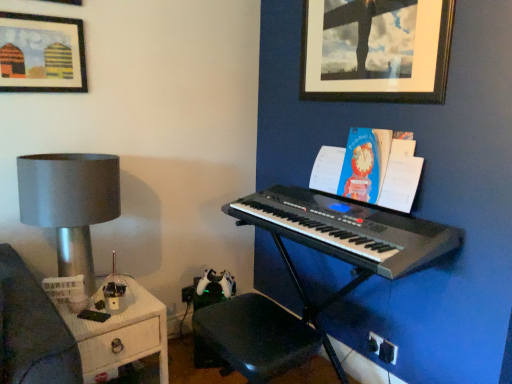
Question: Is matte silver lamp at left placed right next to blue paper book at upper right?

Choices:
 (A) no
 (B) yes

Answer: (A)

Question: From a real-world perspective, is matte silver lamp at left on top of blue paper book at upper right?

Choices:
 (A) no
 (B) yes

Answer: (A)

Question: Is matte silver lamp at left at the left side of blue paper book at upper right?

Choices:
 (A) yes
 (B) no

Answer: (A)

Question: Is matte silver lamp at left bigger than blue paper book at upper right?

Choices:
 (A) no
 (B) yes

Answer: (B)

Question: Considering the relative sizes of matte silver lamp at left and blue paper book at upper right in the image provided, is matte silver lamp at left wider than blue paper book at upper right?

Choices:
 (A) no
 (B) yes

Answer: (B)

Question: In terms of size, does black matte picture frame at upper right, the 2th picture frame positioned from the left, appear bigger or smaller than black plastic keyboard at center?

Choices:
 (A) big
 (B) small

Answer: (B)

Question: Is point (356, 29) positioned closer to the camera than point (377, 218)?

Choices:
 (A) farther
 (B) closer

Answer: (A)

Question: From a real-world perspective, relative to black plastic keyboard at center, is black matte picture frame at upper right, the 2th picture frame positioned from the left, vertically above or below?

Choices:
 (A) below
 (B) above

Answer: (B)

Question: In terms of height, does black matte picture frame at upper right, positioned as the 1th picture frame in right-to-left order, look taller or shorter compared to black plastic keyboard at center?

Choices:
 (A) tall
 (B) short

Answer: (B)

Question: Considering the positions of matte silver lamp at left and blue paper book at upper right in the image, is matte silver lamp at left wider or thinner than blue paper book at upper right?

Choices:
 (A) thin
 (B) wide

Answer: (B)

Question: Looking at the image, does matte silver lamp at left seem bigger or smaller compared to blue paper book at upper right?

Choices:
 (A) big
 (B) small

Answer: (A)

Question: Is matte silver lamp at left taller or shorter than blue paper book at upper right?

Choices:
 (A) short
 (B) tall

Answer: (B)

Question: Is point (60, 210) positioned closer to the camera than point (322, 188)?

Choices:
 (A) closer
 (B) farther

Answer: (A)

Question: From the image's perspective, is matte wood picture frame at upper left, arranged as the 2th picture frame when viewed from the right, located above or below matte silver lamp at left?

Choices:
 (A) above
 (B) below

Answer: (A)

Question: From a real-world perspective, relative to matte silver lamp at left, is matte wood picture frame at upper left, arranged as the 2th picture frame when viewed from the right, vertically above or below?

Choices:
 (A) below
 (B) above

Answer: (B)